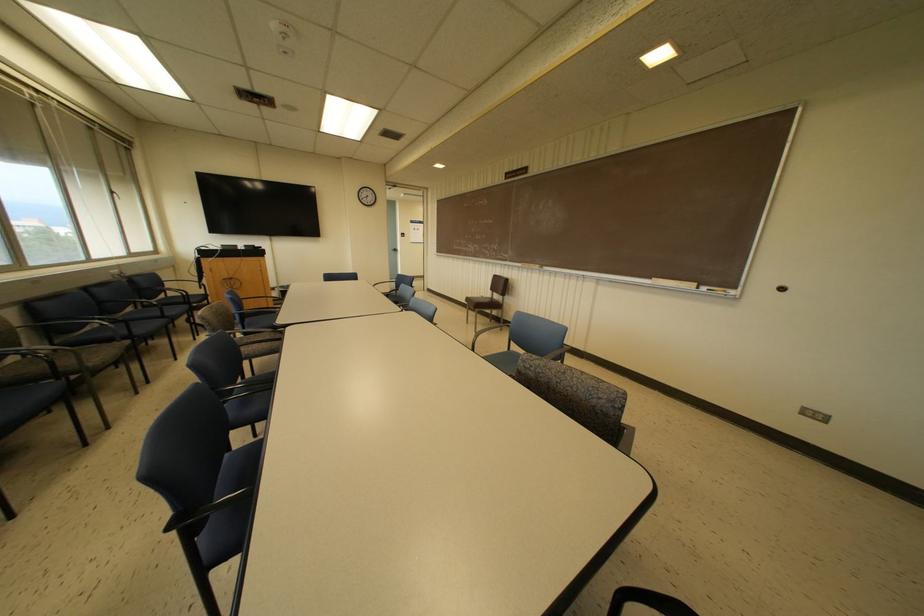
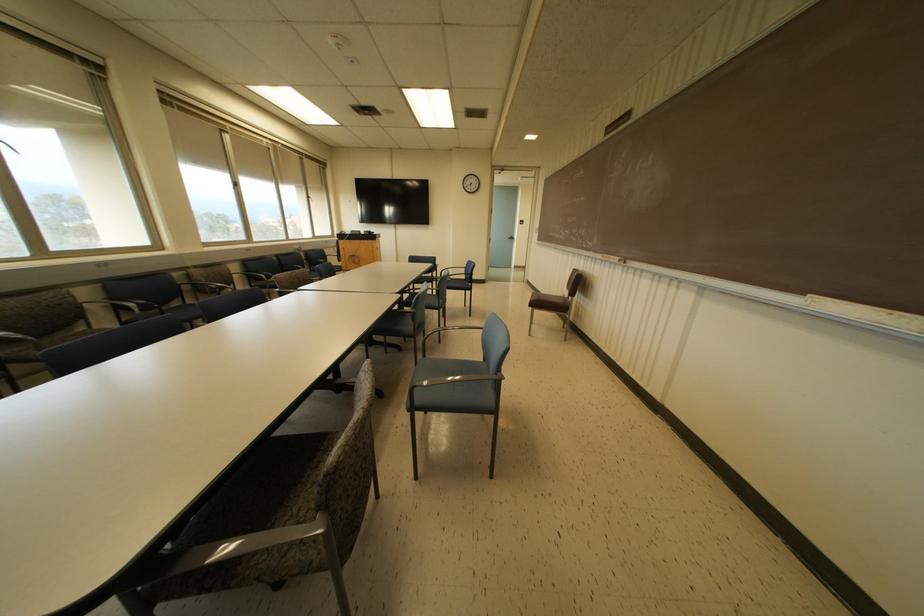
Locate, in the second image, the point that corresponds to pixel 541 265 in the first image.

(623, 259)